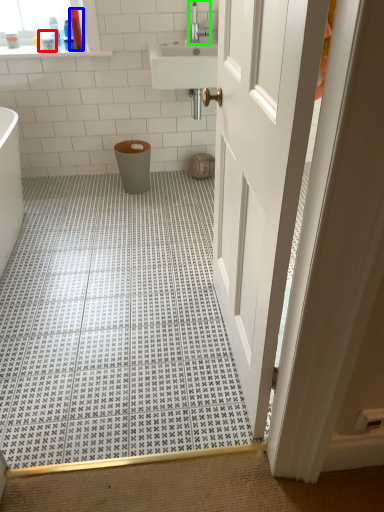
Question: Which object is the closest to the toiletry (highlighted by a red box)? Choose among these: toiletry (highlighted by a blue box) or tap (highlighted by a green box).

Choices:
 (A) toiletry
 (B) tap

Answer: (A)